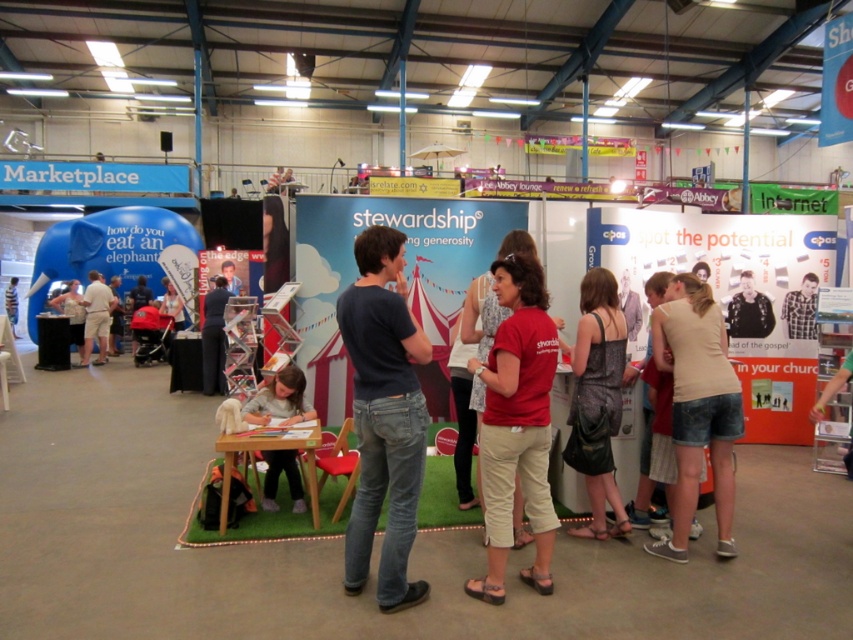
Question: Which point appears farthest from the camera in this image?

Choices:
 (A) (264, 422)
 (B) (83, 352)

Answer: (B)

Question: From the image, what is the correct spatial relationship of black leather jacket at center in relation to light beige shorts at center?

Choices:
 (A) above
 (B) below

Answer: (A)

Question: Which point is closer to the camera?

Choices:
 (A) light gray sweater at center
 (B) dark blue shirt at center
 (C) black leather jacket at center
 (D) plaid shirt at center

Answer: (A)

Question: Does plaid shirt at center lie in front of striped t-shirt at center?

Choices:
 (A) no
 (B) yes

Answer: (B)

Question: Is light gray sweater at center below striped t-shirt at center?

Choices:
 (A) no
 (B) yes

Answer: (B)

Question: Which object is positioned closest to the dark blue shirt at center?

Choices:
 (A) striped t-shirt at center
 (B) denim shorts at center
 (C) light gray sweater at center
 (D) red matte shirt at center

Answer: (C)